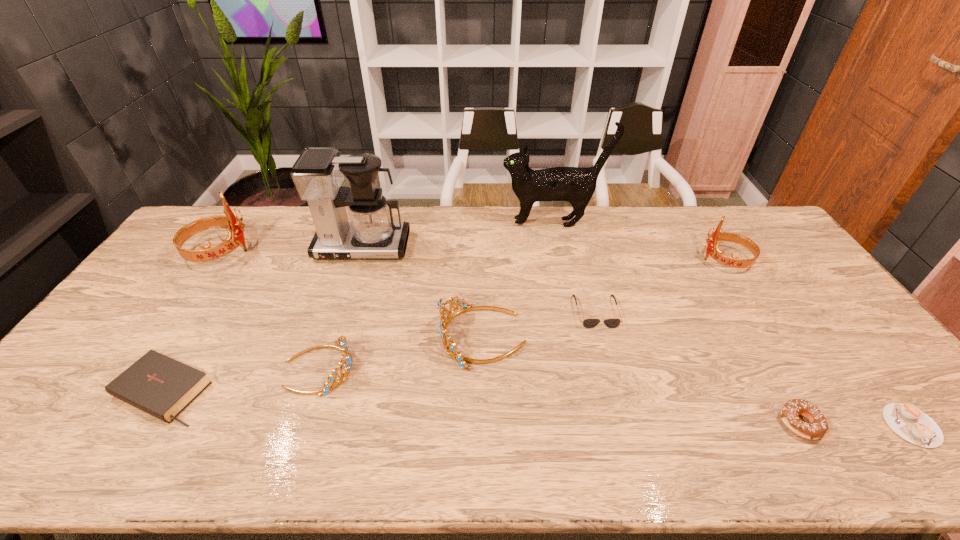
Identify the location of vacant space that is in between the rightmost tiara and the right gold tiara. The width and height of the screenshot is (960, 540). (604, 299).

Identify the location of vacant space that is in between the bigger red tiara and the smaller red tiara. (472, 256).

Find the location of a particular element. Image resolution: width=960 pixels, height=540 pixels. blank region between the smaller red tiara and the gray coffee maker is located at coordinates (543, 254).

This screenshot has height=540, width=960. What are the coordinates of `free space between the Bible and the fifth tallest object` in the screenshot? It's located at (323, 364).

The image size is (960, 540). I want to click on free point between the coffee maker and the leftmost tiara, so click(291, 249).

This screenshot has width=960, height=540. Identify the location of vacant space that's between the Bible and the leftmost tiara. (191, 321).

At what (x,y) coordinates should I click in order to perform the action: click on free area in between the black sunglasses and the black cat. Please return your answer as a coordinate pair (x, y). Image resolution: width=960 pixels, height=540 pixels. Looking at the image, I should click on (574, 267).

What are the coordinates of `blank region between the shortest tiara and the rightmost tiara` in the screenshot? It's located at (522, 314).

What are the coordinates of `blank region between the leftmost tiara and the rightmost tiara` in the screenshot? It's located at (472, 256).

You are a GUI agent. You are given a task and a screenshot of the screen. Output one action in this format:
    pyautogui.click(x=<x>, y=<y>)
    Task: Click on the empty location between the right gold tiara and the smaller gold tiara
    The image size is (960, 540).
    Given the screenshot: What is the action you would take?
    pyautogui.click(x=401, y=353)